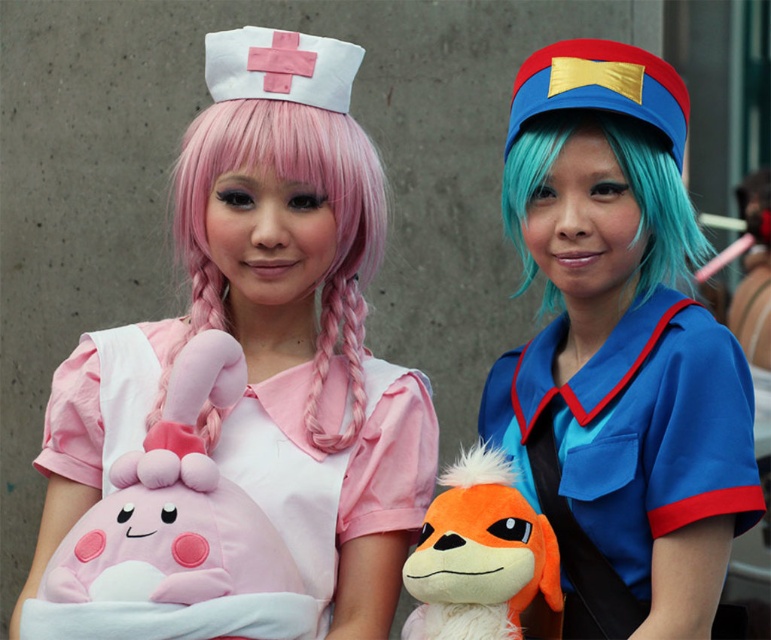
Can you confirm if blue fabric uniform at center is smaller than teal matte wig at right?

No, blue fabric uniform at center is not smaller than teal matte wig at right.

Who is more forward, (679, 413) or (674, 269)?

Point (679, 413)

Find the location of a particular element. This screenshot has width=771, height=640. blue fabric uniform at center is located at coordinates (618, 355).

Find the location of a particular element. Image resolution: width=771 pixels, height=640 pixels. pink silky hair at center is located at coordinates (318, 196).

Find the location of a particular element. pink silky hair at center is located at coordinates (318, 196).

Between point (409, 387) and point (670, 196), which one is positioned in front?

Positioned in front is point (670, 196).

Who is positioned more to the left, soft plush kirby at center or teal matte wig at right?

Answer: Positioned to the left is soft plush kirby at center.

Identify the location of soft plush kirby at center. (332, 468).